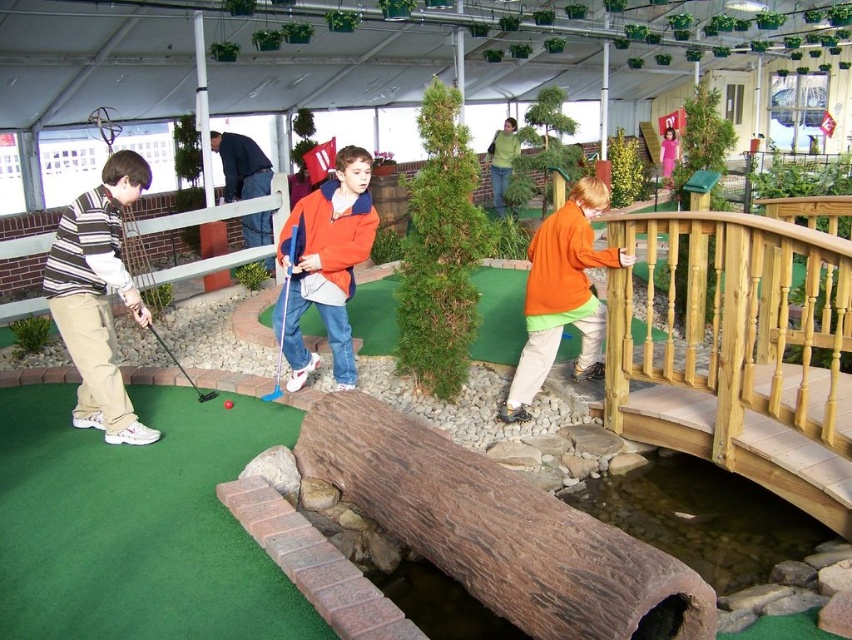
Can you confirm if striped sweater at left is positioned above dark blue sweater at upper left?

No.

Does point (47, 291) lie in front of point (226, 177)?

Yes, point (47, 291) is in front of point (226, 177).

I want to click on striped sweater at left, so click(98, 296).

Does green artificial turf at lower left appear under metallic blue golf club at center?

Yes, green artificial turf at lower left is below metallic blue golf club at center.

Between green artificial turf at lower left and metallic blue golf club at center, which one is positioned higher?

metallic blue golf club at center

Identify the location of green artificial turf at lower left. Image resolution: width=852 pixels, height=640 pixels. (137, 524).

Which is above, striped sweater at left or orange fleece jacket at upper right?

orange fleece jacket at upper right

Which of these two, striped sweater at left or orange fleece jacket at upper right, stands taller?

striped sweater at left

This screenshot has height=640, width=852. What do you see at coordinates (98, 296) in the screenshot?
I see `striped sweater at left` at bounding box center [98, 296].

Locate an element on the screen. Image resolution: width=852 pixels, height=640 pixels. striped sweater at left is located at coordinates (98, 296).